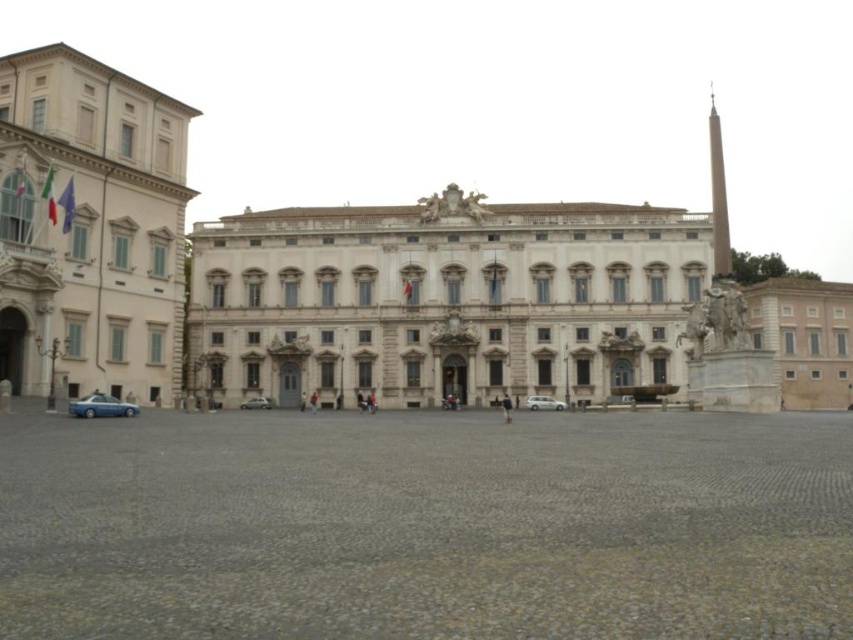
Question: Is white marble building at left bigger than blue metallic car at lower left?

Choices:
 (A) no
 (B) yes

Answer: (B)

Question: Which object is positioned closest to the white stone sculpture at right?

Choices:
 (A) blue metallic car at lower left
 (B) silver metallic car at center
 (C) white matte car at center

Answer: (C)

Question: Based on their relative distances, which object is nearer to the white stone sculpture at right?

Choices:
 (A) blue metallic car at lower left
 (B) white marble building at left
 (C) silver metallic car at center

Answer: (B)

Question: Is white marble building at left wider than blue metallic car at lower left?

Choices:
 (A) no
 (B) yes

Answer: (B)

Question: Which point is closer to the camera taking this photo?

Choices:
 (A) (799, 368)
 (B) (428, 248)

Answer: (B)

Question: Does white marble palace at center come in front of white stone sculpture at right?

Choices:
 (A) yes
 (B) no

Answer: (B)